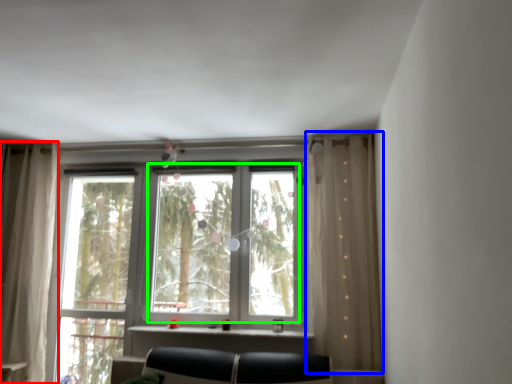
Question: Which object is positioned farthest from curtain (highlighted by a red box)? Select from curtain (highlighted by a blue box) and bay window (highlighted by a green box).

Choices:
 (A) curtain
 (B) bay window

Answer: (A)